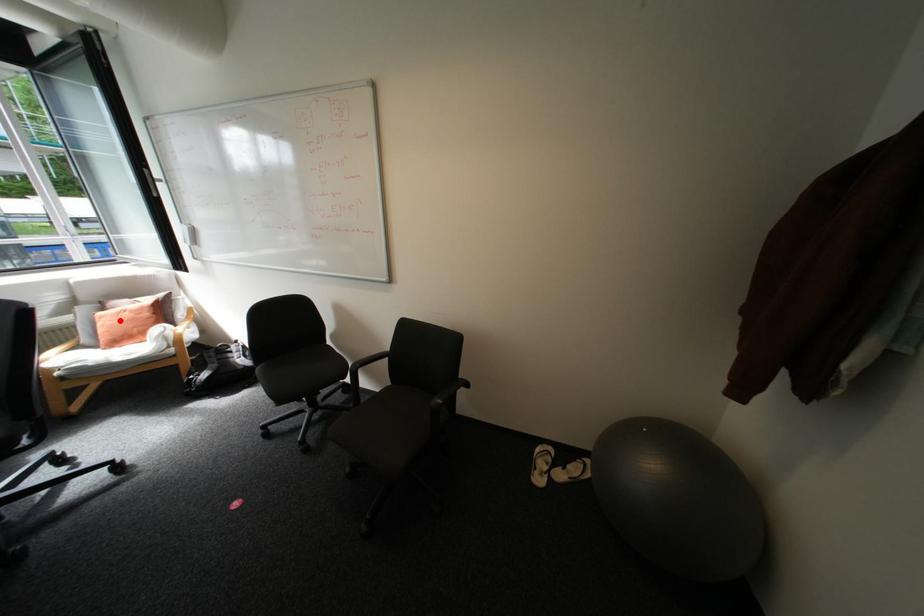
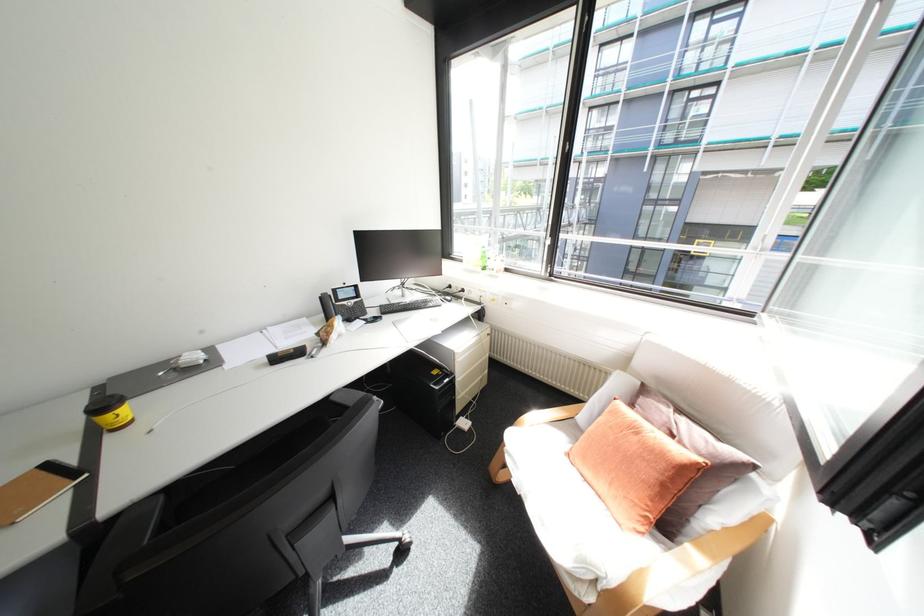
Question: I am providing you with two images of the same scene from different viewpoints. Image1 has a red point marked. In image2, the corresponding 3D location appears at what relative position? Reply with the corresponding letter.

Choices:
 (A) Closer
 (B) Farther

Answer: (A)